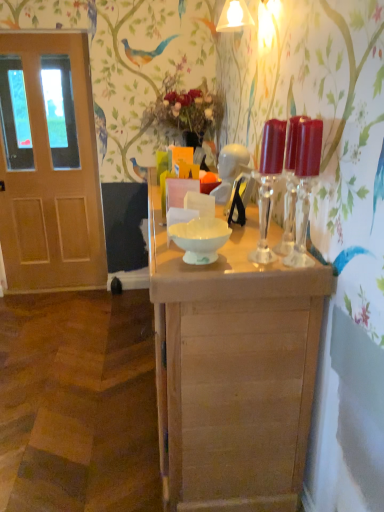
Question: Does translucent glass candle holders at right, positioned as the 1th candle holder in right-to-left order, turn towards transparent glass candle holders at center, marked as the 1th candle holder in a left-to-right arrangement?

Choices:
 (A) no
 (B) yes

Answer: (A)

Question: Is translucent glass candle holders at right, which is counted as the 2th candle holder, starting from the left, further to the viewer compared to transparent glass candle holders at center, placed as the 2th candle holder when sorted from right to left?

Choices:
 (A) no
 (B) yes

Answer: (A)

Question: Is translucent glass candle holders at right, positioned as the 1th candle holder in right-to-left order, beside transparent glass candle holders at center, placed as the 2th candle holder when sorted from right to left?

Choices:
 (A) no
 (B) yes

Answer: (A)

Question: Is translucent glass candle holders at right, which is counted as the 2th candle holder, starting from the left, at the right side of transparent glass candle holders at center, marked as the 1th candle holder in a left-to-right arrangement?

Choices:
 (A) no
 (B) yes

Answer: (B)

Question: Is translucent glass candle holders at right, positioned as the 1th candle holder in right-to-left order, shorter than transparent glass candle holders at center, placed as the 2th candle holder when sorted from right to left?

Choices:
 (A) yes
 (B) no

Answer: (B)

Question: Can you confirm if translucent glass candle holders at right, positioned as the 1th candle holder in right-to-left order, is taller than transparent glass candle holders at center, marked as the 1th candle holder in a left-to-right arrangement?

Choices:
 (A) yes
 (B) no

Answer: (A)

Question: From a real-world perspective, is transparent glass candle holders at center, marked as the 1th candle holder in a left-to-right arrangement, physically below light brown wooden table at center?

Choices:
 (A) yes
 (B) no

Answer: (B)

Question: From the image's perspective, is transparent glass candle holders at center, placed as the 2th candle holder when sorted from right to left, beneath light brown wooden table at center?

Choices:
 (A) no
 (B) yes

Answer: (A)

Question: Is transparent glass candle holders at center, marked as the 1th candle holder in a left-to-right arrangement, far away from light brown wooden table at center?

Choices:
 (A) yes
 (B) no

Answer: (B)

Question: Could you tell me if transparent glass candle holders at center, placed as the 2th candle holder when sorted from right to left, is turned towards light brown wooden table at center?

Choices:
 (A) yes
 (B) no

Answer: (B)

Question: From the image's perspective, does transparent glass candle holders at center, marked as the 1th candle holder in a left-to-right arrangement, appear higher than light brown wooden table at center?

Choices:
 (A) yes
 (B) no

Answer: (A)

Question: Could light brown wooden table at center be considered to be inside transparent glass candle holders at center, placed as the 2th candle holder when sorted from right to left?

Choices:
 (A) no
 (B) yes

Answer: (A)

Question: From the image's perspective, is transparent glass candle holders at center, placed as the 2th candle holder when sorted from right to left, on top of translucent glass candle holders at right, which is counted as the 2th candle holder, starting from the left?

Choices:
 (A) no
 (B) yes

Answer: (B)